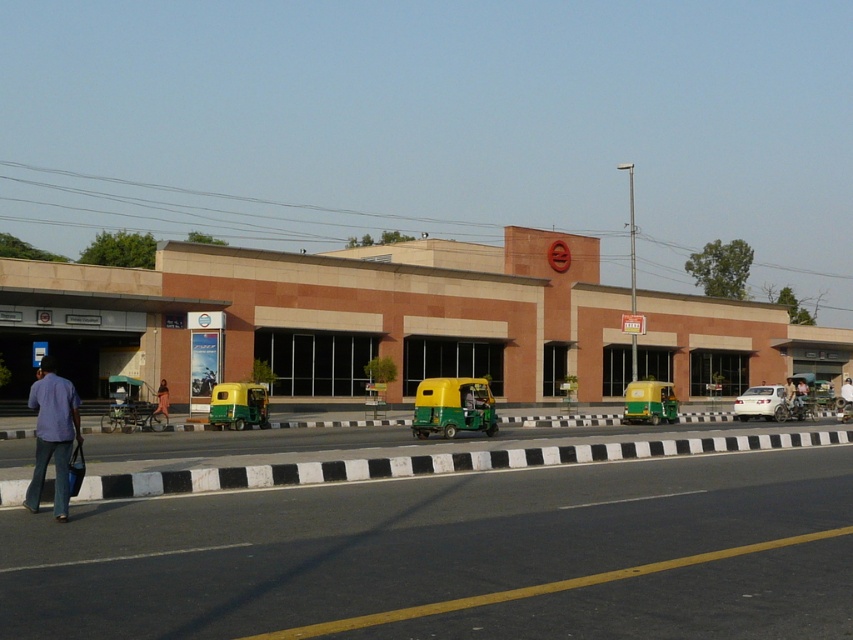
Question: Which point is farther to the camera?

Choices:
 (A) [x=97, y=477]
 (B) [x=846, y=396]
 (C) [x=680, y=324]
 (D) [x=782, y=387]

Answer: (C)

Question: Which of the following is the farthest from the observer?

Choices:
 (A) denim pants at lower left
 (B) pink fabric dress at center

Answer: (B)

Question: In this image, where is black rubber barrier at lower left located relative to white fabric shirt at center?

Choices:
 (A) below
 (B) above

Answer: (B)

Question: Does brick building at center lie in front of black rubber barrier at lower left?

Choices:
 (A) yes
 (B) no

Answer: (B)

Question: Which point is closer to the camera?

Choices:
 (A) (595, 397)
 (B) (621, 451)
 (C) (735, 410)

Answer: (B)

Question: Is brick building at center further to camera compared to white matte car at center?

Choices:
 (A) yes
 (B) no

Answer: (B)